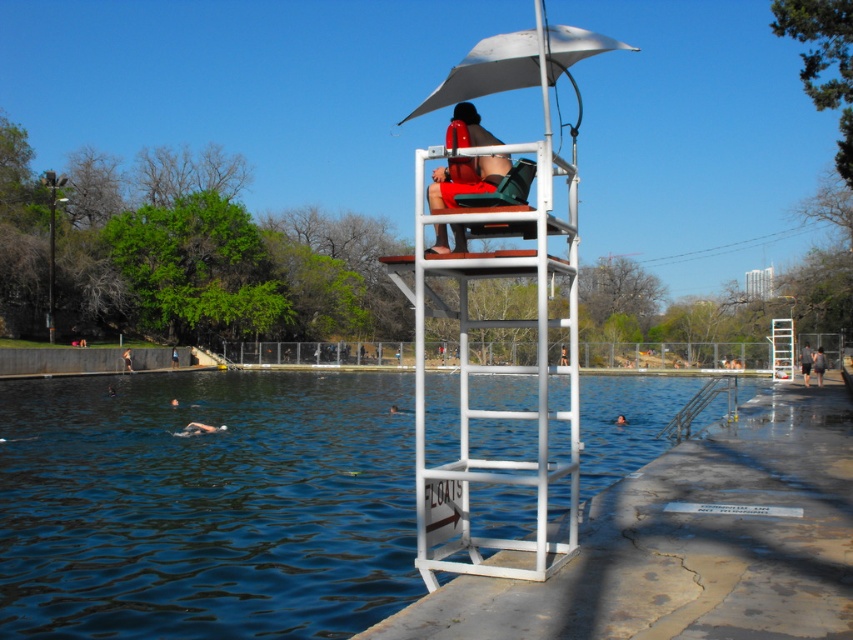
Question: Which object appears farthest from the camera in this image?

Choices:
 (A) black fabric shorts at lower right
 (B) white plastic ladder at center

Answer: (B)

Question: Among these points, which one is farthest from the camera?

Choices:
 (A) (177, 364)
 (B) (123, 371)
 (C) (822, 360)
 (D) (440, 193)

Answer: (A)

Question: Can you confirm if white matte umbrella at upper center is wider than blue fabric shirt at upper center?

Choices:
 (A) yes
 (B) no

Answer: (A)

Question: Can you confirm if white matte umbrella at upper center is wider than gray fabric shirt at right?

Choices:
 (A) no
 (B) yes

Answer: (A)

Question: Can you confirm if white metal ladder at center is positioned below black fabric shorts at lower right?

Choices:
 (A) yes
 (B) no

Answer: (B)

Question: Considering the real-world distances, which object is closest to the white metal ladder at center?

Choices:
 (A) white plastic ladder at center
 (B) matte red life vest at center
 (C) blue fabric shirt at upper center

Answer: (B)